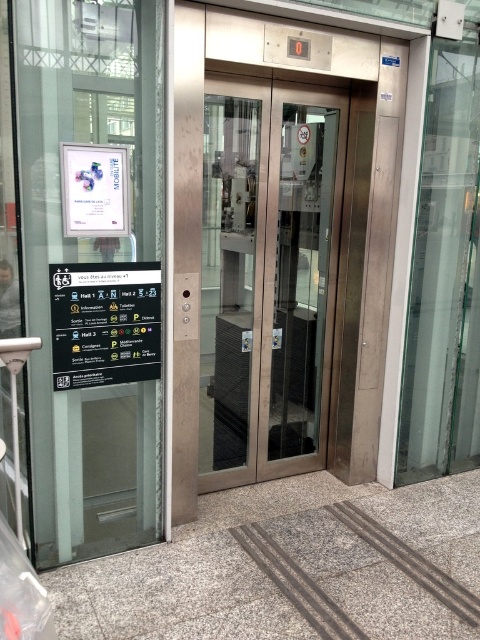
From the picture: You are standing in front of the elevator entrance and need to locate the transparent glass door at left. According to the scene description, where would you find it?

The transparent glass door at left is located at point (92, 268).

You are standing in front of the elevator entrance and need to check the informational sign to the left. Can you see the transparent glass door at left from your current position?

Yes, the transparent glass door at left is located at point (92, 268), so it is visible from your current position in front of the elevator entrance.